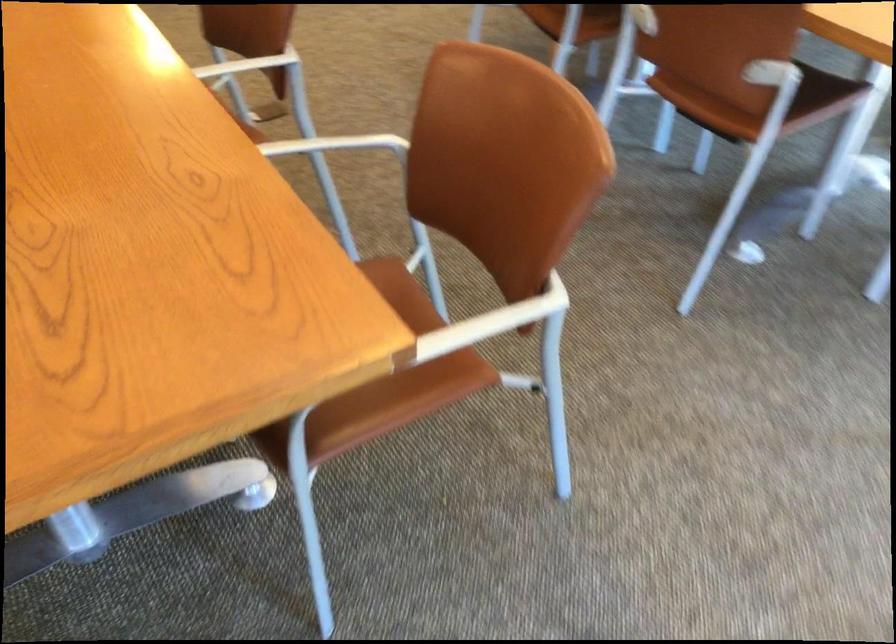
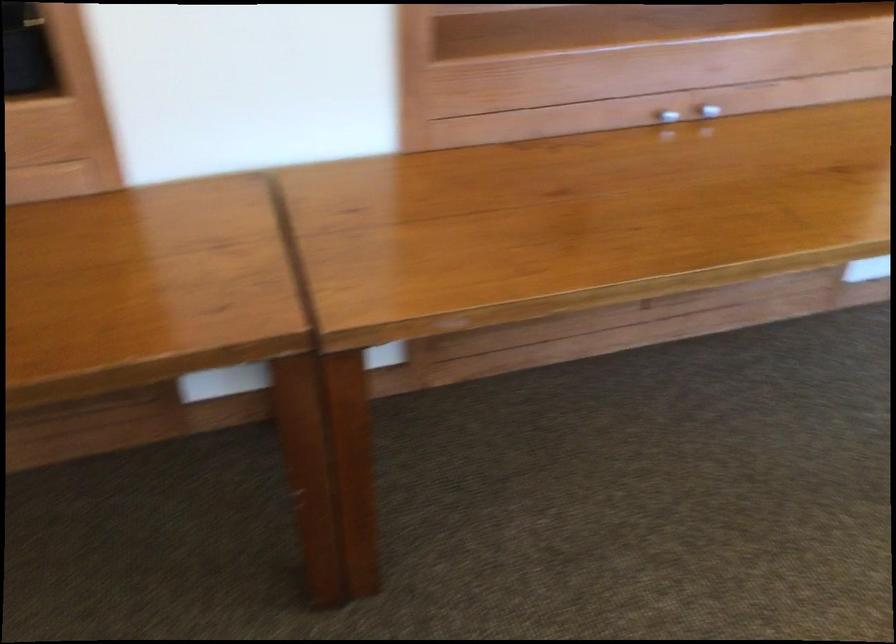
In a continuous first-person perspective shot, in which direction is the camera moving?

The cameraman moved toward left, forward.